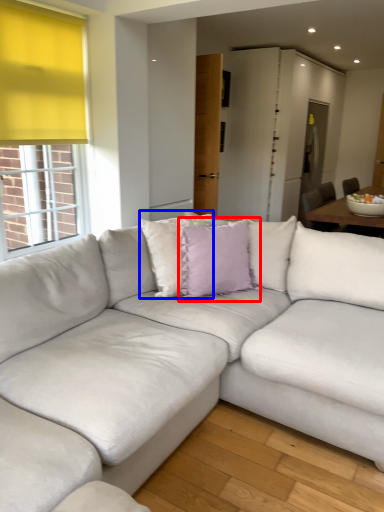
Question: Among these objects, which one is nearest to the camera, pillow (highlighted by a red box) or pillow (highlighted by a blue box)?

Choices:
 (A) pillow
 (B) pillow

Answer: (B)